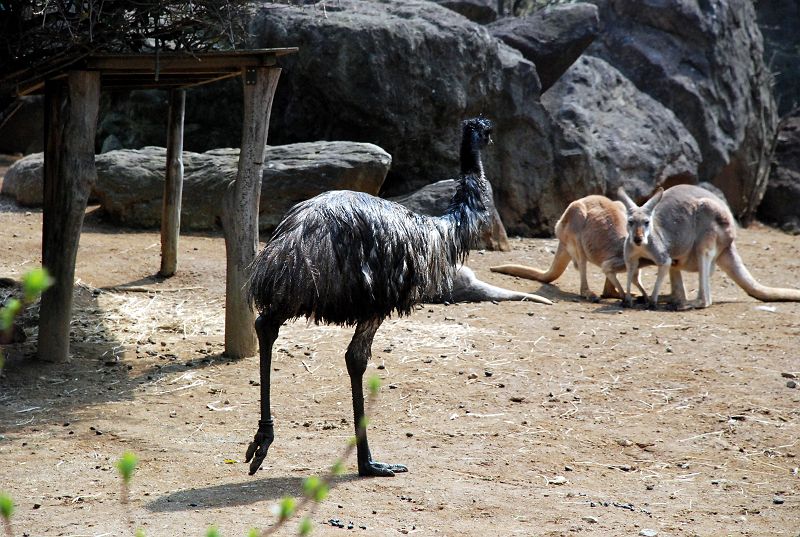
Locate an element on the screen. plant is located at coordinates (38, 272), (6, 510), (130, 461), (298, 502), (310, 518).